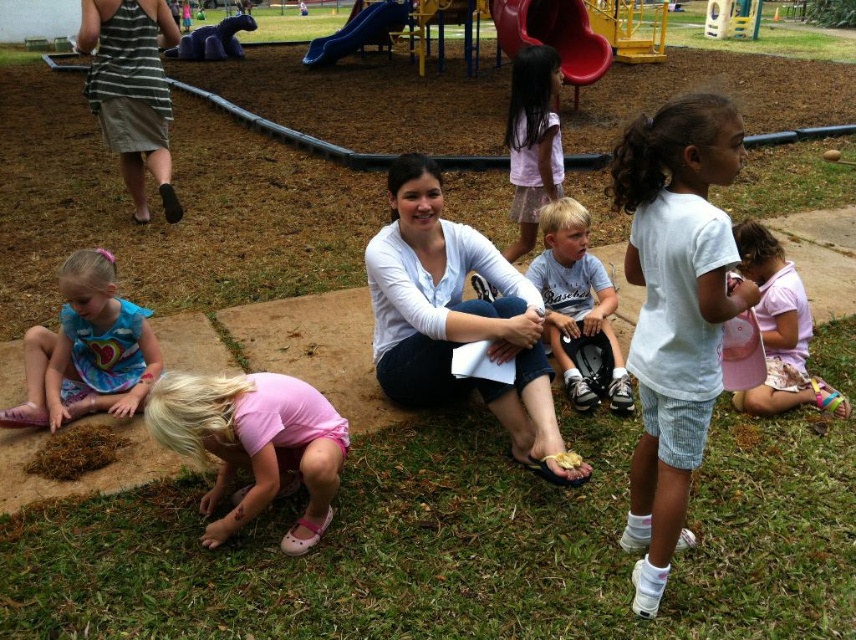
Between blue cotton dress at lower left and smooth blue slide at upper center, which one has less height?

blue cotton dress at lower left

Is blue cotton dress at lower left thinner than smooth blue slide at upper center?

Indeed, blue cotton dress at lower left has a lesser width compared to smooth blue slide at upper center.

Image resolution: width=856 pixels, height=640 pixels. Describe the element at coordinates (87, 349) in the screenshot. I see `blue cotton dress at lower left` at that location.

This screenshot has height=640, width=856. Find the location of `blue cotton dress at lower left`. blue cotton dress at lower left is located at coordinates (87, 349).

Which is below, white cotton shirt at center or pink fabric hat at lower right?

white cotton shirt at center is lower down.

The height and width of the screenshot is (640, 856). What do you see at coordinates (675, 310) in the screenshot?
I see `white cotton shirt at center` at bounding box center [675, 310].

Image resolution: width=856 pixels, height=640 pixels. In order to click on white cotton shirt at center in this screenshot , I will do `click(675, 310)`.

Who is more forward, (298,460) or (161,148)?

Point (298,460) is in front.

Does pink fabric dress at lower center have a lesser width compared to striped cotton shirt at upper left?

Yes, pink fabric dress at lower center is thinner than striped cotton shirt at upper left.

What do you see at coordinates (253, 444) in the screenshot? I see `pink fabric dress at lower center` at bounding box center [253, 444].

Locate an element on the screen. pink fabric dress at lower center is located at coordinates (253, 444).